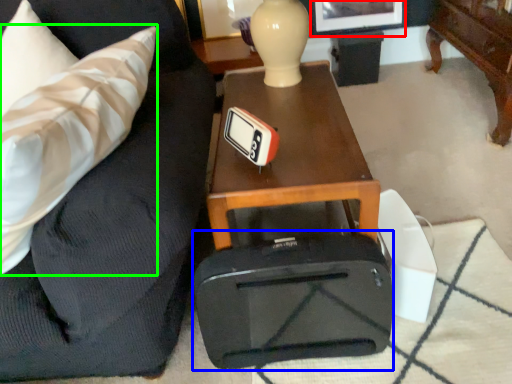
Question: Which object is the closest to the picture frame (highlighted by a red box)? Choose among these: luggage (highlighted by a blue box) or throw pillow (highlighted by a green box).

Choices:
 (A) luggage
 (B) throw pillow

Answer: (B)